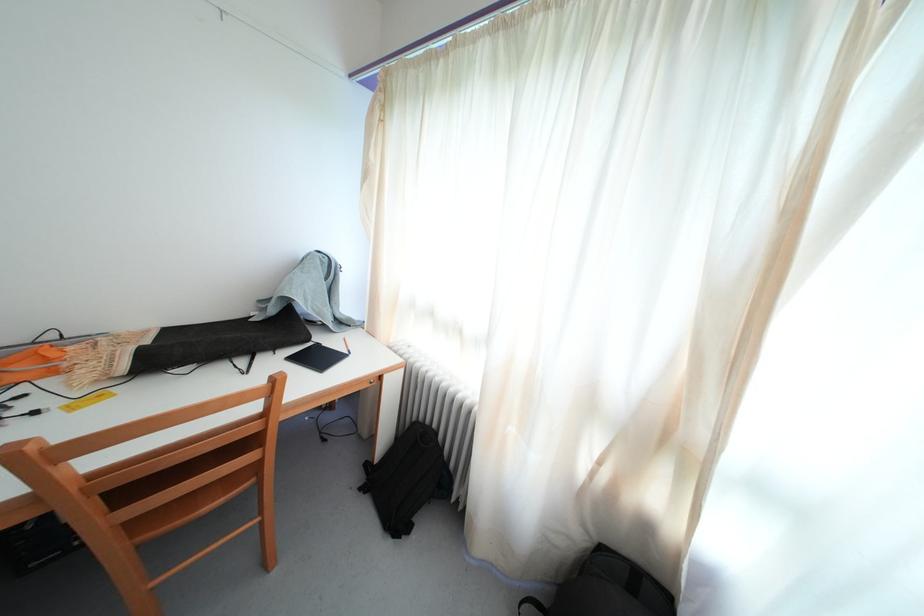
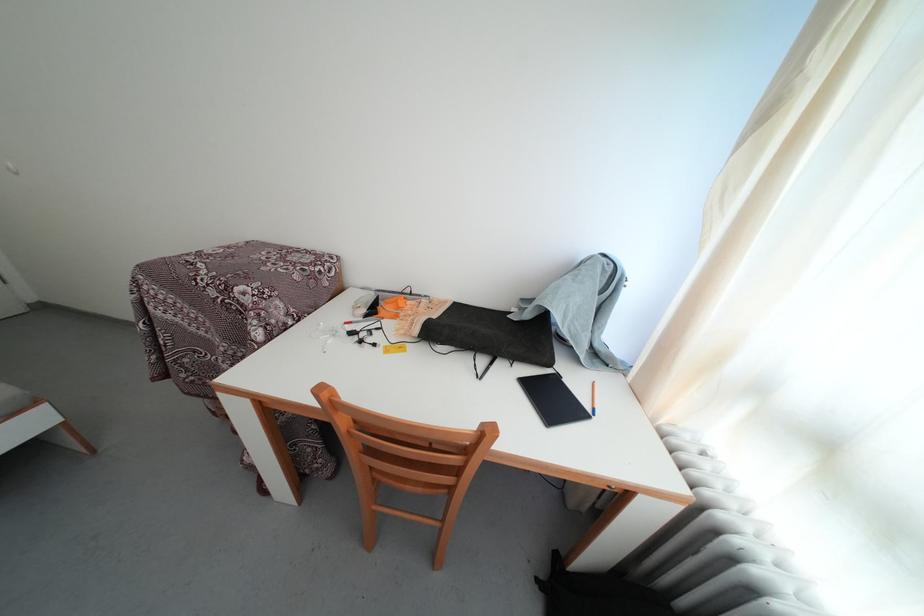
Question: The first image is from the beginning of the video and the second image is from the end. How did the camera likely rotate when shooting the video?

Choices:
 (A) Left
 (B) Right
 (C) Up
 (D) Down

Answer: (A)